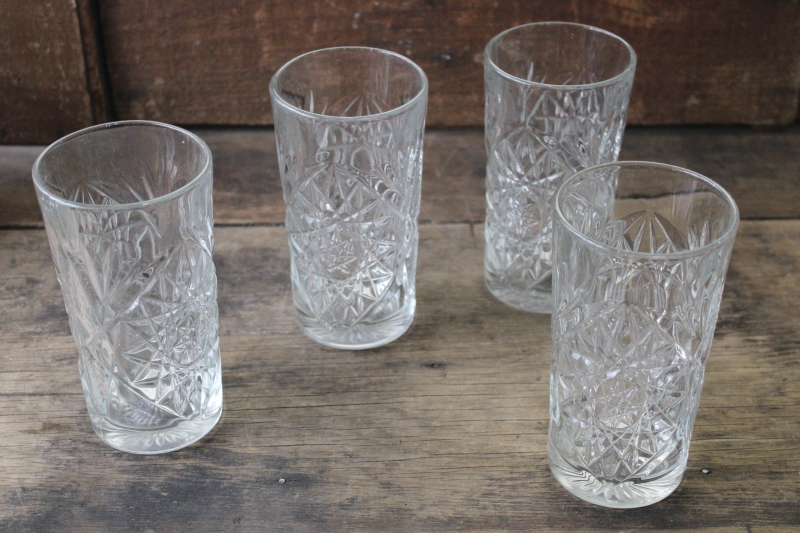
In order to click on intricate glass design in this screenshot , I will do `click(180, 323)`, `click(353, 238)`, `click(633, 377)`, `click(510, 174)`.